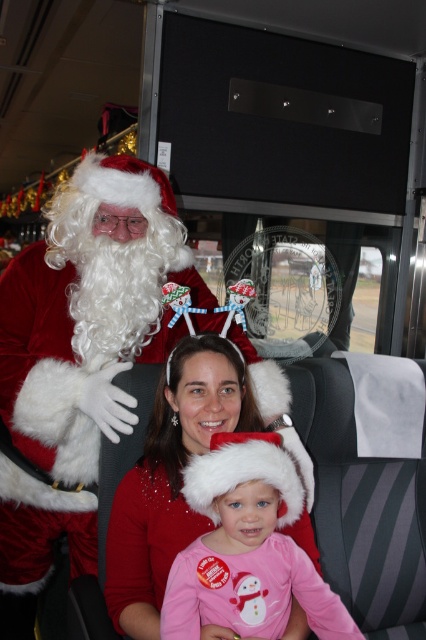
Between matte red sweater at center and pink fleece hat at center, which one is positioned lower?

pink fleece hat at center is below.

Does matte red sweater at center have a larger size compared to pink fleece hat at center?

Yes, matte red sweater at center is bigger than pink fleece hat at center.

At what (x,y) coordinates should I click in order to perform the action: click on matte red sweater at center. Please return your answer as a coordinate pair (x, y). Looking at the image, I should click on (172, 476).

Is point (88, 317) farther from viewer compared to point (230, 595)?

Yes, point (88, 317) is behind point (230, 595).

At what (x,y) coordinates should I click in order to perform the action: click on velvet santa claus at upper left. Please return your answer as a coordinate pair (x, y). The height and width of the screenshot is (640, 426). Looking at the image, I should click on (80, 352).

Does velvet santa claus at upper left lie in front of matte red sweater at center?

That is False.

Can you confirm if velvet santa claus at upper left is positioned below matte red sweater at center?

No.

Does point (83, 448) come behind point (227, 397)?

Yes, point (83, 448) is farther from viewer.

At what (x,y) coordinates should I click in order to perform the action: click on velvet santa claus at upper left. Please return your answer as a coordinate pair (x, y). This screenshot has width=426, height=640. Looking at the image, I should click on (80, 352).